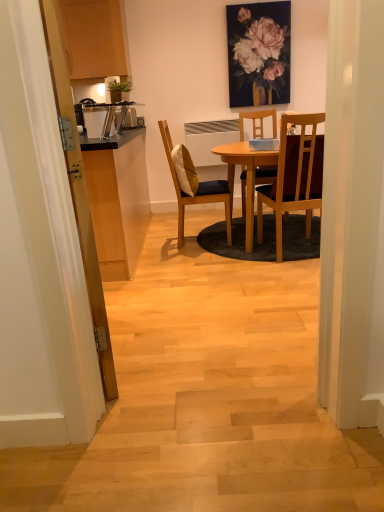
Locate an element on the screen. Image resolution: width=384 pixels, height=512 pixels. empty space that is to the right of transparent wooden door at left is located at coordinates (188, 337).